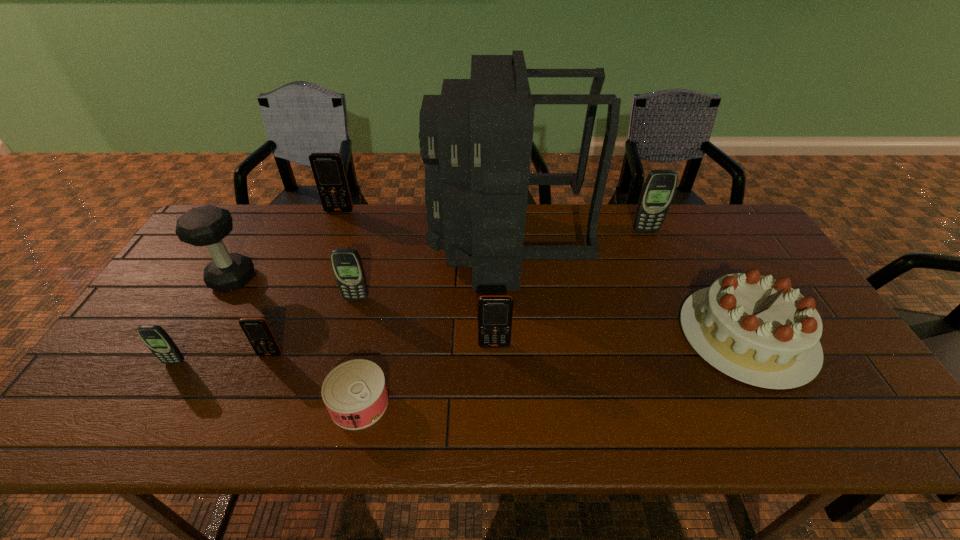
Identify the location of the closest orange cellular telephone to the biggest orange cellular telephone. Image resolution: width=960 pixels, height=540 pixels. (257, 330).

Identify which orange cellular telephone is the second nearest to the dumbbell. Please provide its 2D coordinates. Your answer should be formatted as a tuple, i.e. [(x, y)], where the tuple contains the x and y coordinates of a point satisfying the conditions above.

[(327, 167)]

Where is `the closest gray cellular telephone to the nearest gray cellular telephone`? Image resolution: width=960 pixels, height=540 pixels. the closest gray cellular telephone to the nearest gray cellular telephone is located at coordinates click(347, 265).

Find the location of a particular element. The width and height of the screenshot is (960, 540). the third closest gray cellular telephone to the rightmost orange cellular telephone is located at coordinates (155, 337).

At what (x,y) coordinates should I click in order to perform the action: click on blank space that satisfies the following two spatial constraints: 1. on the front compartment of the gray backpack; 2. on the screen of the fourth nearest cellular telephone. Please return your answer as a coordinate pair (x, y). Looking at the image, I should click on (510, 299).

Locate an element on the screen. The width and height of the screenshot is (960, 540). vacant space that satisfies the following two spatial constraints: 1. on the front compartment of the tallest object; 2. on the screen of the fourth nearest cellular telephone is located at coordinates (510, 299).

This screenshot has height=540, width=960. Find the location of `free location that satisfies the following two spatial constraints: 1. on the screen of the fourth nearest cellular telephone; 2. on the left side of the can`. free location that satisfies the following two spatial constraints: 1. on the screen of the fourth nearest cellular telephone; 2. on the left side of the can is located at coordinates (328, 403).

Find the location of a particular element. The image size is (960, 540). vacant area that satisfies the following two spatial constraints: 1. on the screen of the can; 2. on the right side of the second gray cellular telephone from right to left is located at coordinates (328, 403).

What are the coordinates of `vacant region that satisfies the following two spatial constraints: 1. on the front compartment of the gray backpack; 2. on the screen of the third nearest cellular telephone` in the screenshot? It's located at (513, 346).